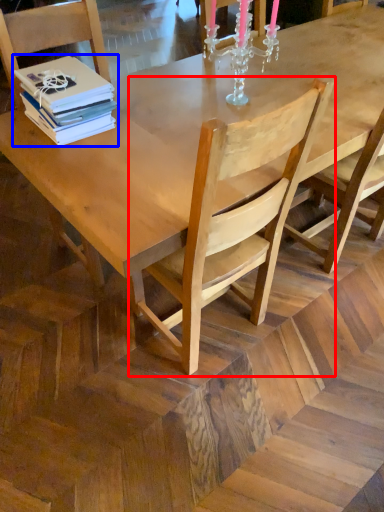
Question: Which of the following is the farthest to the observer, chair (highlighted by a red box) or book (highlighted by a blue box)?

Choices:
 (A) chair
 (B) book

Answer: (B)